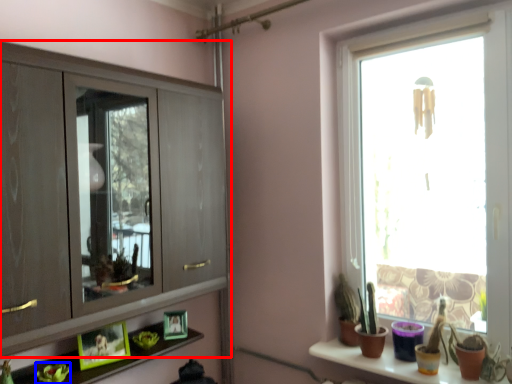
Question: Among these objects, which one is farthest to the camera, cupboard (highlighted by a red box) or plant (highlighted by a blue box)?

Choices:
 (A) cupboard
 (B) plant

Answer: (B)